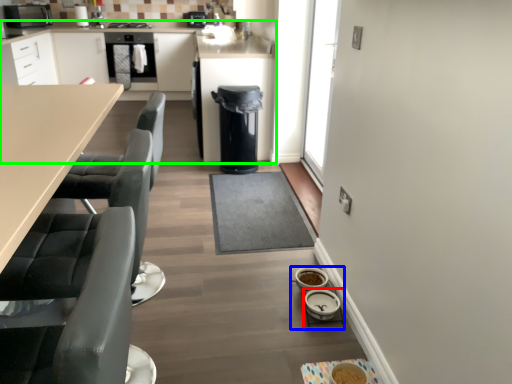
Question: Which object is positioned closest to appliance (highlighted by a red box)? Select from appliance (highlighted by a blue box) and cabinetry (highlighted by a green box).

Choices:
 (A) appliance
 (B) cabinetry

Answer: (A)